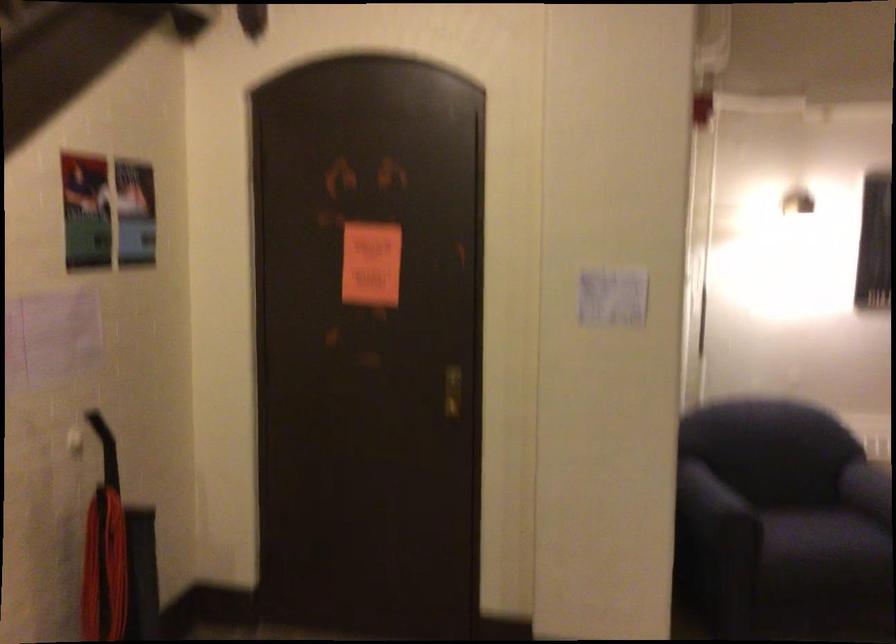
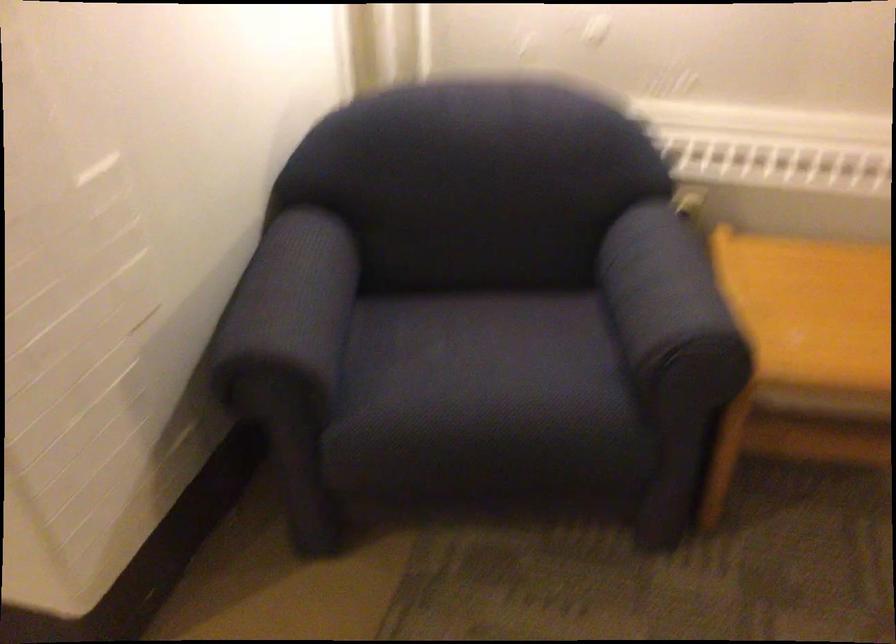
Find the pixel in the second image that matches (707,489) in the first image.

(289, 307)